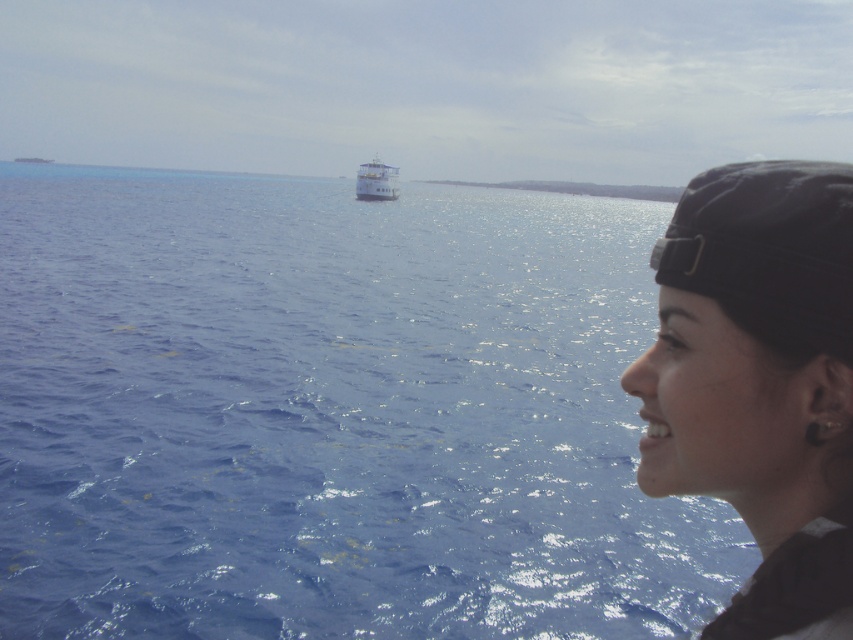
Question: Is blue glossy water at center smaller than black matte headband at right?

Choices:
 (A) no
 (B) yes

Answer: (A)

Question: Is blue glossy water at center positioned behind black matte headband at right?

Choices:
 (A) yes
 (B) no

Answer: (A)

Question: Among these objects, which one is nearest to the camera?

Choices:
 (A) blue glossy water at center
 (B) black matte headband at right

Answer: (B)

Question: Which point is farther from the camera taking this photo?

Choices:
 (A) (379, 168)
 (B) (54, 182)
 (C) (741, 602)

Answer: (A)

Question: Based on their relative distances, which object is farther from the black matte headband at right?

Choices:
 (A) blue glossy water at center
 (B) white glossy boat at center

Answer: (B)

Question: Is blue glossy water at center to the left of white glossy boat at center from the viewer's perspective?

Choices:
 (A) yes
 (B) no

Answer: (B)